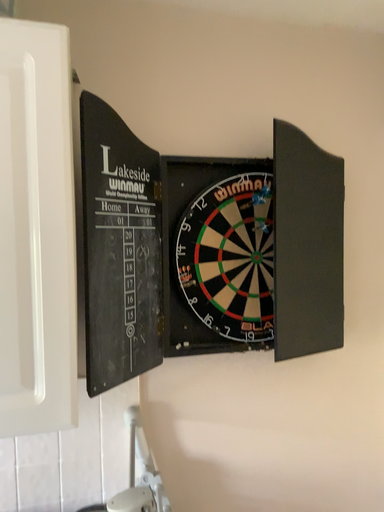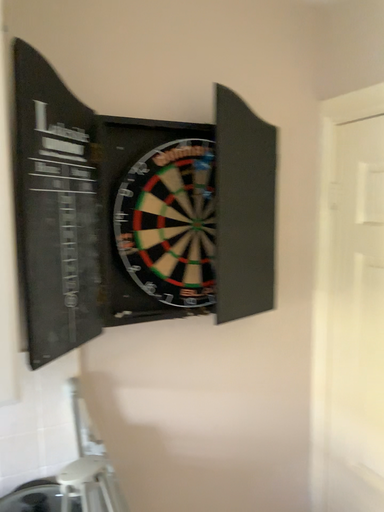
Question: Which way did the camera rotate in the video?

Choices:
 (A) rotated left
 (B) rotated right

Answer: (B)